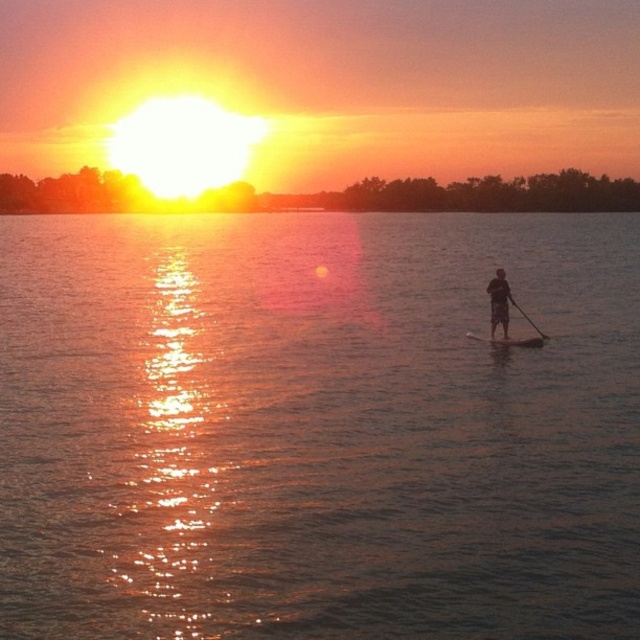
Question: Does glistening water at center appear on the right side of black smooth paddle at right?

Choices:
 (A) yes
 (B) no

Answer: (B)

Question: Estimate the real-world distances between objects in this image. Which object is farther from the dark gray fabric paddleboard at right?

Choices:
 (A) glistening water at center
 (B) black smooth paddle at right
 (C) smooth wooden paddleboard at right

Answer: (A)

Question: Which of these objects is positioned closest to the smooth wooden paddleboard at right?

Choices:
 (A) black smooth paddle at right
 (B) glistening water at center

Answer: (A)

Question: Does glistening water at center lie in front of dark gray fabric paddleboard at right?

Choices:
 (A) no
 (B) yes

Answer: (B)

Question: Is dark gray fabric paddleboard at right further to the viewer compared to smooth wooden paddleboard at right?

Choices:
 (A) yes
 (B) no

Answer: (B)

Question: Which of these objects is positioned closest to the glistening water at center?

Choices:
 (A) smooth wooden paddleboard at right
 (B) black smooth paddle at right

Answer: (A)